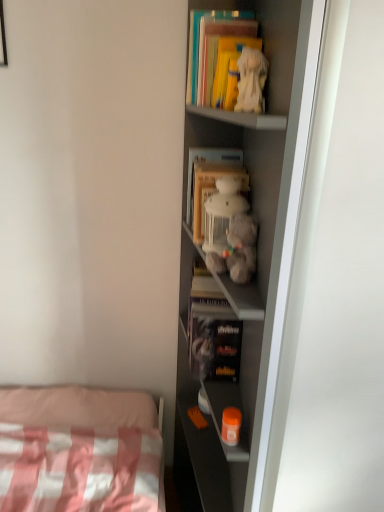
Question: Which direction should I rotate to look at wooden bookshelf at center, which is the second book in bottom-to-top order?

Choices:
 (A) right
 (B) left

Answer: (A)

Question: From the image's perspective, would you say orange plastic container at lower center, the fourth toy when ordered from top to bottom, is positioned over hardcover book at center, the first book when ordered from bottom to top?

Choices:
 (A) no
 (B) yes

Answer: (A)

Question: Are orange plastic container at lower center, the fourth toy when ordered from top to bottom, and hardcover book at center, the first book when ordered from bottom to top, making contact?

Choices:
 (A) no
 (B) yes

Answer: (A)

Question: Considering the relative sizes of orange plastic container at lower center, which is the first toy in bottom-to-top order, and hardcover book at center, the first book when ordered from bottom to top, in the image provided, is orange plastic container at lower center, which is the first toy in bottom-to-top order, thinner than hardcover book at center, the first book when ordered from bottom to top,?

Choices:
 (A) yes
 (B) no

Answer: (A)

Question: Does orange plastic container at lower center, which is the first toy in bottom-to-top order, come behind hardcover book at center, arranged as the 4th book when viewed from the top?

Choices:
 (A) no
 (B) yes

Answer: (A)

Question: Considering the relative sizes of orange plastic container at lower center, which is the first toy in bottom-to-top order, and hardcover book at center, arranged as the 4th book when viewed from the top, in the image provided, is orange plastic container at lower center, which is the first toy in bottom-to-top order, bigger than hardcover book at center, arranged as the 4th book when viewed from the top,?

Choices:
 (A) no
 (B) yes

Answer: (A)

Question: Does orange plastic container at lower center, which is the first toy in bottom-to-top order, appear on the right side of hardcover book at center, the first book when ordered from bottom to top?

Choices:
 (A) yes
 (B) no

Answer: (A)

Question: Considering the relative sizes of matte gray shelf at center and yellow matte book at upper center, which is the 3th book in bottom-to-top order, in the image provided, is matte gray shelf at center shorter than yellow matte book at upper center, which is the 3th book in bottom-to-top order,?

Choices:
 (A) no
 (B) yes

Answer: (A)

Question: Does matte gray shelf at center have a smaller size compared to yellow matte book at upper center, which is the second book from top to bottom?

Choices:
 (A) no
 (B) yes

Answer: (A)

Question: From a real-world perspective, is matte gray shelf at center located higher than yellow matte book at upper center, which is the 3th book in bottom-to-top order?

Choices:
 (A) yes
 (B) no

Answer: (B)

Question: Does matte gray shelf at center touch yellow matte book at upper center, which is the second book from top to bottom?

Choices:
 (A) yes
 (B) no

Answer: (B)

Question: From a real-world perspective, is matte gray shelf at center positioned under yellow matte book at upper center, which is the 3th book in bottom-to-top order, based on gravity?

Choices:
 (A) yes
 (B) no

Answer: (A)

Question: Is matte gray shelf at center positioned with its back to yellow matte book at upper center, which is the 3th book in bottom-to-top order?

Choices:
 (A) no
 (B) yes

Answer: (B)

Question: From the image's perspective, would you say matte yellow book at upper center, arranged as the first book when viewed from the top, is shown under matte gray shelf at center?

Choices:
 (A) no
 (B) yes

Answer: (A)